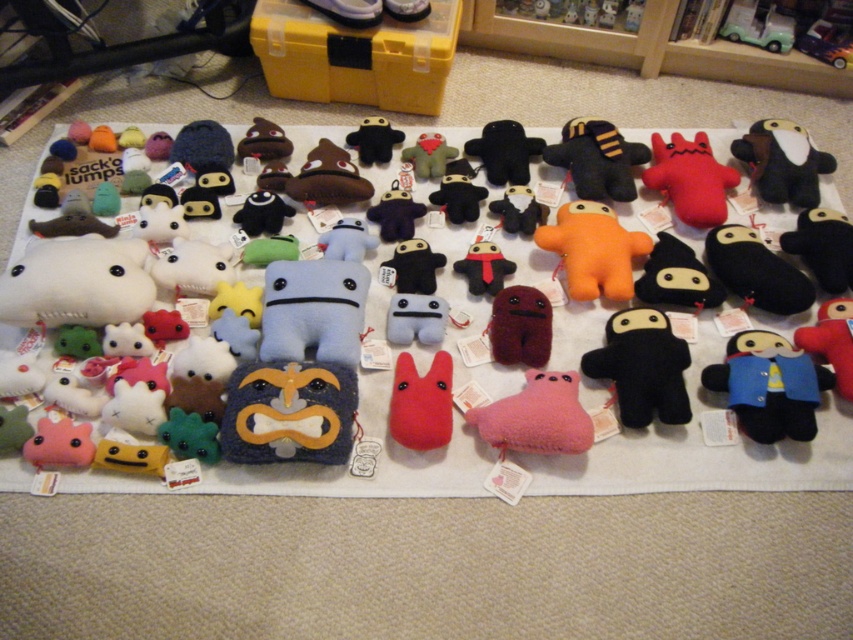
You are organizing a toy drive and need to know if the velvety black ninja at center is in front of or behind the velvet plush panda at upper right. Based on the scene description, can you determine their positions relative to each other?

The velvety black ninja at center is behind the velvet plush panda at upper right, so the velvet plush panda at upper right is in front of the velvety black ninja at center.

You are organizing a display of plush toys on a white cloth. You need to place a new toy at the point marked by the coordinates point (288, 412). What is already located at that position?

The point (288, 412) marks the location of the fuzzy blue plush at center.